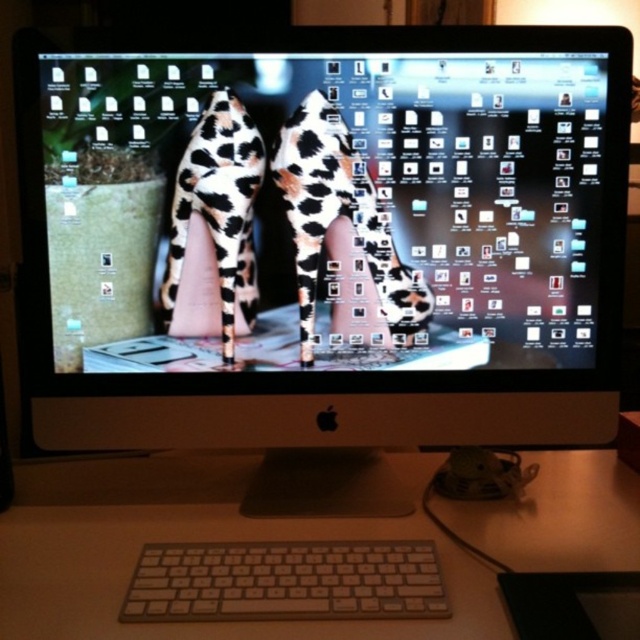
You are setting up a new computer desk and need to place two white plastic keyboards. The scene shows two keyboards labeled as white plastic keyboard at center and white plastic keyboard at lower center. Based on their positions, which keyboard should you place higher on your desk to match the setup?

The white plastic keyboard at center should be placed higher on the desk since it is much taller than the white plastic keyboard at lower center according to the description.

You are setting up your computer desk and notice two white plastic keyboards. The first one is labeled as the white plastic keyboard at center, and the second is the white plastic keyboard at lower center. From your perspective sitting at the desk, which keyboard is positioned higher on the desk?

The white plastic keyboard at center is positioned higher on the desk as it is above the white plastic keyboard at lower center.